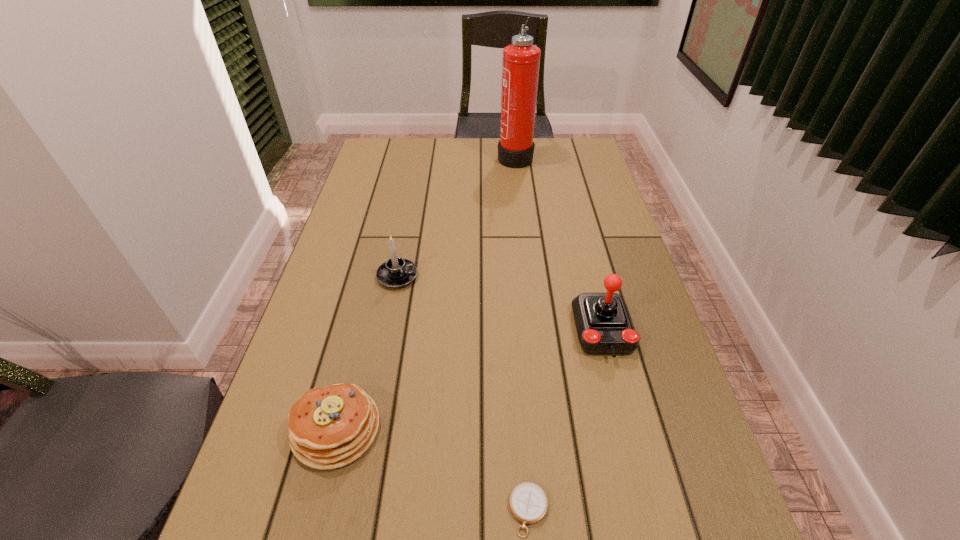
Locate an element on the screen. The width and height of the screenshot is (960, 540). vacant region located 0.070m on the front-facing side of the farthest object is located at coordinates (478, 156).

In order to click on vacant space located on the front-facing side of the farthest object in this screenshot , I will do `click(429, 156)`.

This screenshot has height=540, width=960. I want to click on vacant space located 0.160m on the base of the rightmost object, so click(629, 434).

Locate an element on the screen. Image resolution: width=960 pixels, height=540 pixels. vacant area situated with a handle on the side of the fourth nearest object is located at coordinates (437, 276).

This screenshot has height=540, width=960. I want to click on free region located 0.160m on the right of the second shortest object, so click(x=462, y=428).

At what (x,y) coordinates should I click in order to perform the action: click on vacant space located 0.390m on the back of the shortest object. Please return your answer as a coordinate pair (x, y). Image resolution: width=960 pixels, height=540 pixels. Looking at the image, I should click on (515, 318).

The width and height of the screenshot is (960, 540). In order to click on object that is at the far edge in this screenshot , I will do `click(520, 68)`.

The height and width of the screenshot is (540, 960). I want to click on candle holder present at the left edge, so click(396, 272).

This screenshot has height=540, width=960. In order to click on pancake located in the left edge section of the desktop in this screenshot , I will do `click(331, 427)`.

This screenshot has height=540, width=960. I want to click on object that is at the right edge, so click(604, 326).